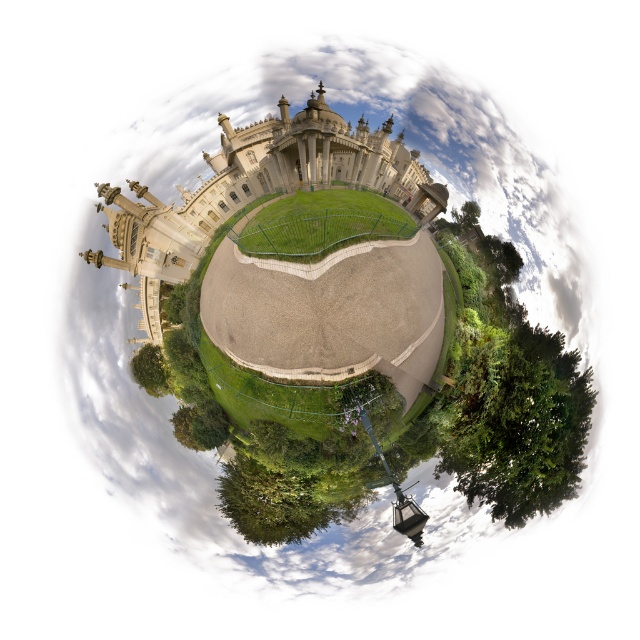
Between point (518, 476) and point (156, 349), which one is positioned behind?

The point (518, 476) is behind.

Is green leafy tree at lower right above green leafy tree at center?

Actually, green leafy tree at lower right is below green leafy tree at center.

In order to click on green leafy tree at lower right in this screenshot , I will do `click(508, 392)`.

Can you confirm if green leafy tree at lower right is shorter than white stone amphitheater at center?

No.

Which is above, green leafy tree at lower right or white stone amphitheater at center?

white stone amphitheater at center is above.

Consider the image. Measure the distance between point (x=560, y=416) and camera.

The distance of point (x=560, y=416) from camera is 205.44 feet.

Locate an element on the screen. green leafy tree at lower right is located at coordinates (508, 392).

From the picture: Who is positioned more to the left, white stone amphitheater at center or green leafy tree at center?

green leafy tree at center is more to the left.

Which is above, white stone amphitheater at center or green leafy tree at center?

white stone amphitheater at center

I want to click on white stone amphitheater at center, so click(x=250, y=189).